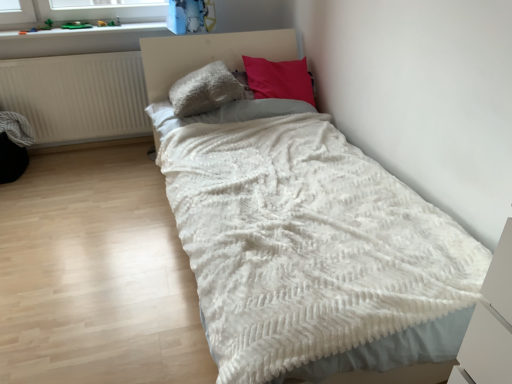
Question: Considering the relative sizes of smooth plastic toys at upper left and fluffy gray pillow at center, the first pillow from the left, in the image provided, is smooth plastic toys at upper left taller than fluffy gray pillow at center, the first pillow from the left,?

Choices:
 (A) no
 (B) yes

Answer: (A)

Question: Can you confirm if smooth plastic toys at upper left is thinner than fluffy gray pillow at center, the first pillow from the left?

Choices:
 (A) yes
 (B) no

Answer: (A)

Question: From a real-world perspective, does smooth plastic toys at upper left stand above fluffy gray pillow at center, positioned as the second pillow in right-to-left order?

Choices:
 (A) yes
 (B) no

Answer: (A)

Question: From the image's perspective, does smooth plastic toys at upper left appear lower than fluffy gray pillow at center, the first pillow from the left?

Choices:
 (A) no
 (B) yes

Answer: (A)

Question: Does smooth plastic toys at upper left have a smaller size compared to fluffy gray pillow at center, the first pillow from the left?

Choices:
 (A) yes
 (B) no

Answer: (A)

Question: Is smooth plastic toys at upper left beside fluffy gray pillow at center, positioned as the second pillow in right-to-left order?

Choices:
 (A) yes
 (B) no

Answer: (B)

Question: Can you confirm if smooth plastic toys at upper left is shorter than white matte radiator at left?

Choices:
 (A) yes
 (B) no

Answer: (A)

Question: From a real-world perspective, is smooth plastic toys at upper left on top of white matte radiator at left?

Choices:
 (A) no
 (B) yes

Answer: (B)

Question: Is smooth plastic toys at upper left looking in the opposite direction of white matte radiator at left?

Choices:
 (A) no
 (B) yes

Answer: (A)

Question: Considering the relative sizes of smooth plastic toys at upper left and white matte radiator at left in the image provided, is smooth plastic toys at upper left taller than white matte radiator at left?

Choices:
 (A) yes
 (B) no

Answer: (B)

Question: Does smooth plastic toys at upper left turn towards white matte radiator at left?

Choices:
 (A) yes
 (B) no

Answer: (B)

Question: From the image's perspective, is smooth plastic toys at upper left above white matte radiator at left?

Choices:
 (A) yes
 (B) no

Answer: (A)

Question: Is white matte radiator at left a part of white fluffy blanket at center?

Choices:
 (A) yes
 (B) no

Answer: (B)